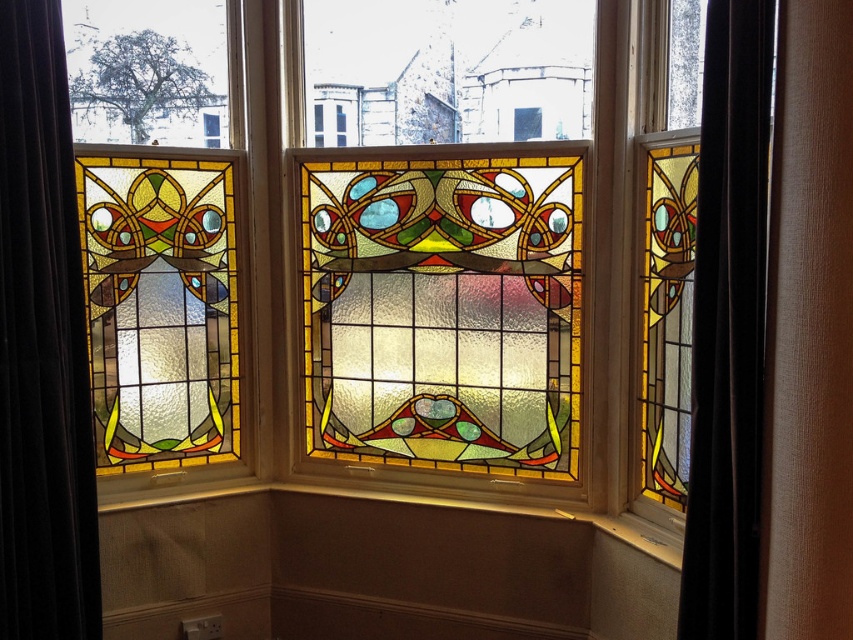
Question: Is multicolored stained glass at center thinner than velvet dark brown curtain at left?

Choices:
 (A) no
 (B) yes

Answer: (A)

Question: Is multicolored stained glass at center to the left of black velvet curtain at right from the viewer's perspective?

Choices:
 (A) yes
 (B) no

Answer: (A)

Question: In this image, where is multicolored stained glass at center located relative to black velvet curtain at right?

Choices:
 (A) below
 (B) above

Answer: (B)

Question: Which point is closer to the camera?

Choices:
 (A) (15, 1)
 (B) (722, 570)
 (C) (397, 497)
 (D) (498, 419)

Answer: (B)

Question: Which object appears closest to the camera in this image?

Choices:
 (A) black velvet curtain at right
 (B) matte wood window sill at center

Answer: (A)

Question: Estimate the real-world distances between objects in this image. Which object is farther from the black velvet curtain at right?

Choices:
 (A) matte wood window sill at center
 (B) multicolored stained glass at center
 (C) velvet dark brown curtain at left

Answer: (C)